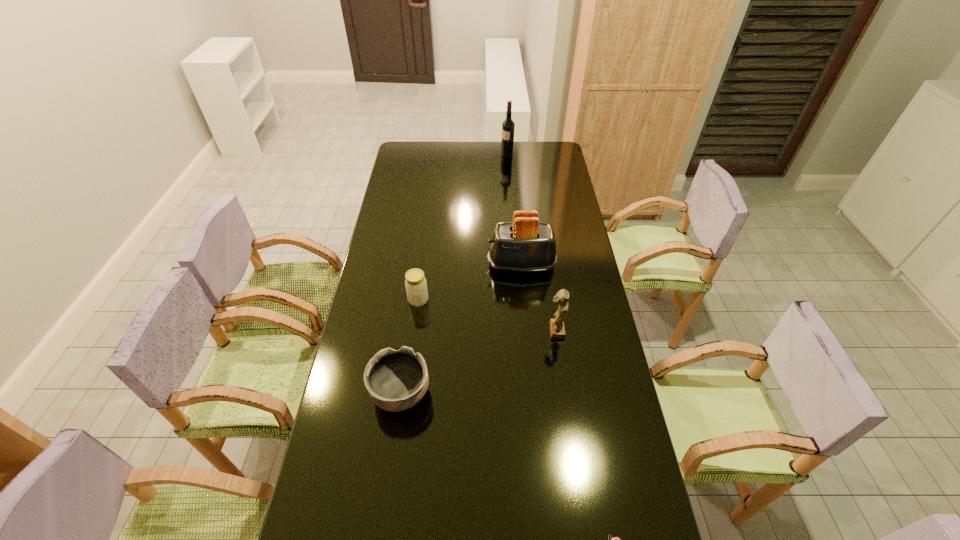
Locate an element on the screen. toaster at the right edge is located at coordinates (525, 245).

Where is `figurine at the right edge`? The image size is (960, 540). figurine at the right edge is located at coordinates (557, 329).

The width and height of the screenshot is (960, 540). I want to click on vacant space at the far edge of the desktop, so tap(476, 144).

In the image, there is a desktop. Where is `vacant space at the left edge`? Image resolution: width=960 pixels, height=540 pixels. vacant space at the left edge is located at coordinates (324, 462).

The width and height of the screenshot is (960, 540). I want to click on free space at the right edge of the desktop, so click(x=564, y=211).

Locate an element on the screen. free space between the jar and the farthest object is located at coordinates (463, 228).

Where is `free space between the second tallest object and the fourth shortest object`? free space between the second tallest object and the fourth shortest object is located at coordinates (539, 298).

This screenshot has width=960, height=540. I want to click on vacant region between the fourth nearest object and the third nearest object, so click(x=487, y=315).

Identify the location of empty location between the second nearest object and the third nearest object. (478, 362).

The height and width of the screenshot is (540, 960). I want to click on unoccupied position between the second tallest object and the wine bottle, so pos(515,210).